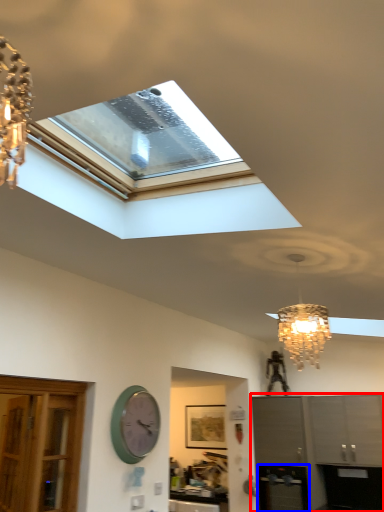
Question: Which object appears farthest to the camera in this image, cabinetry (highlighted by a red box) or appliance (highlighted by a blue box)?

Choices:
 (A) cabinetry
 (B) appliance

Answer: (B)